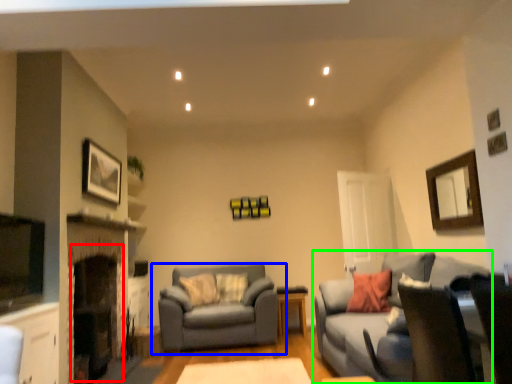
Question: Which is nearer to the fireplace (highlighted by a red box)? studio couch (highlighted by a blue box) or studio couch (highlighted by a green box).

Choices:
 (A) studio couch
 (B) studio couch

Answer: (A)